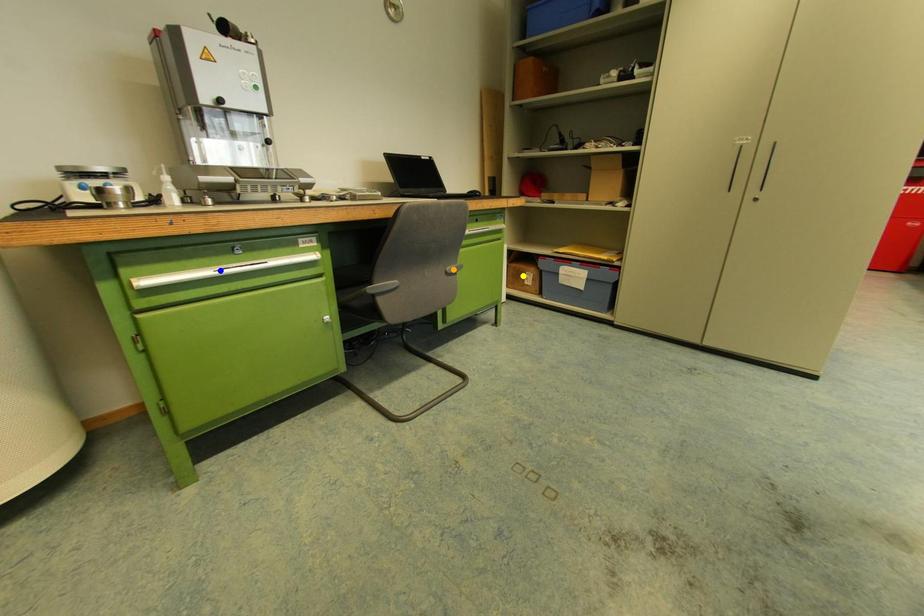
Order these from nearest to farthest:
yellow point, orange point, blue point

blue point < orange point < yellow point